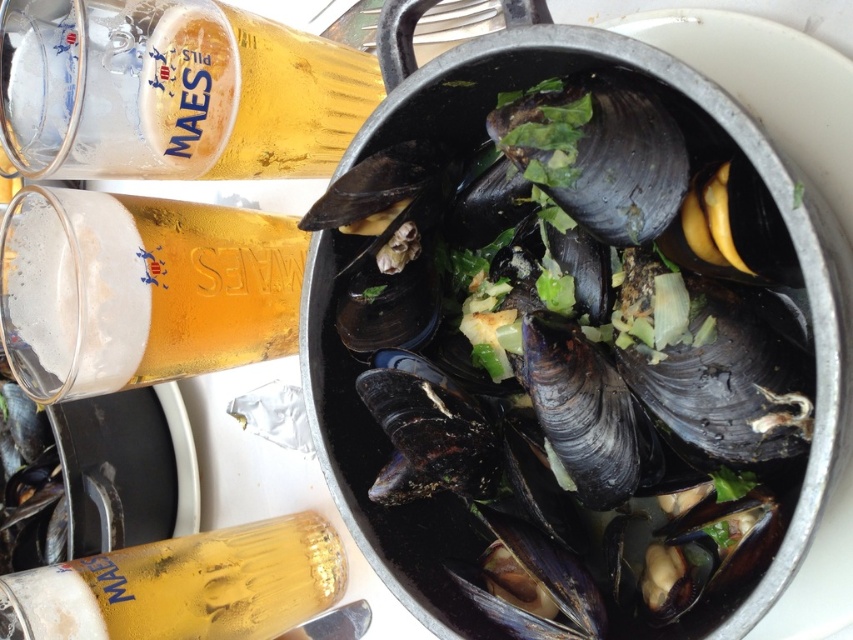
You are a bartender who needs to clean the translucent glass beer at upper left. The cleaning station is 1 meter away. Can you reach the glass without moving your position?

The distance between the translucent glass beer at upper left and the viewer is 45.02 centimeters, which is less than 1 meter. Therefore, the bartender can reach the glass without moving their position.

You are at a dinner table and want to choose the larger drink container between the translucent glass beer at upper left and the translucent glass bottle at lower left. Which one should you pick?

The translucent glass beer at upper left has a larger size compared to the translucent glass bottle at lower left, so you should pick the translucent glass beer at upper left.